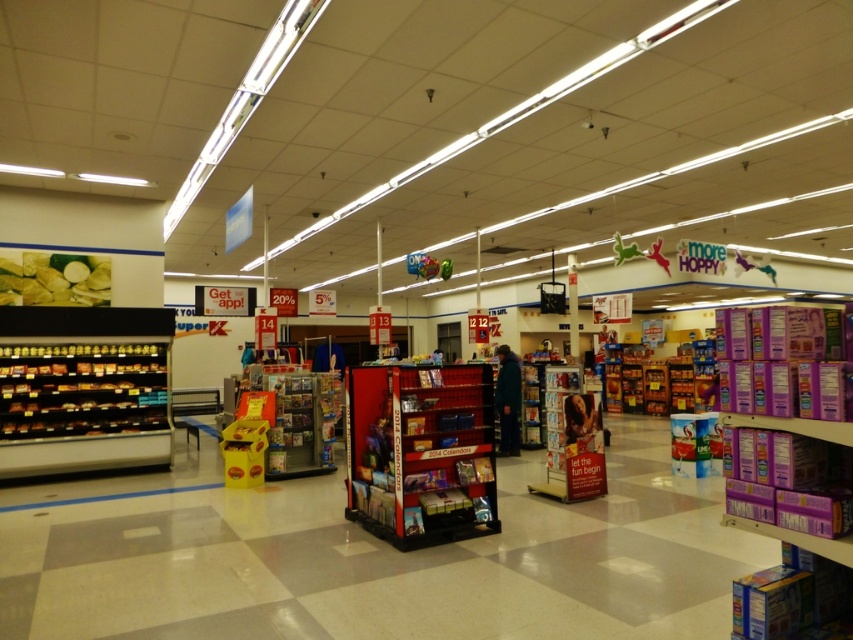
Question: Considering the relative positions of metallic silver calendar at center and dark blue jacket at center in the image provided, where is metallic silver calendar at center located with respect to dark blue jacket at center?

Choices:
 (A) left
 (B) right

Answer: (B)

Question: Is metallic red display rack at center closer to camera compared to dark blue jacket at center?

Choices:
 (A) yes
 (B) no

Answer: (A)

Question: Which object appears closest to the camera in this image?

Choices:
 (A) metallic silver calendar at center
 (B) dark blue jacket at center
 (C) matte plastic magazine rack at center
 (D) metallic red display rack at center

Answer: (D)

Question: Which of the following is the closest to the observer?

Choices:
 (A) metallic silver calendar at center
 (B) metallic red display rack at center
 (C) dark blue jacket at center
 (D) matte plastic magazine rack at center

Answer: (B)

Question: Considering the real-world distances, which object is farthest from the metallic silver calendar at center?

Choices:
 (A) matte plastic magazine rack at center
 (B) dark blue jacket at center
 (C) metallic red display rack at center
 (D) metallic silver shelves at left

Answer: (D)

Question: Can you confirm if metallic red display rack at center is positioned to the left of metallic silver calendar at center?

Choices:
 (A) no
 (B) yes

Answer: (B)